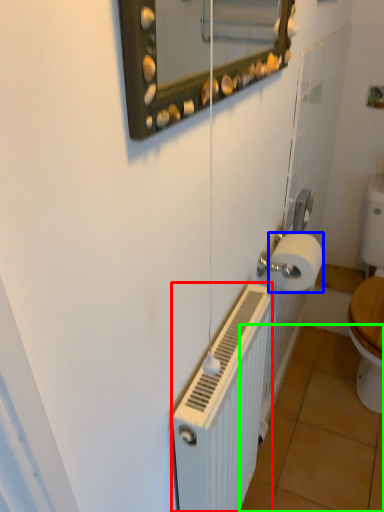
Question: Based on their relative distances, which object is nearer to radiator (highlighted by a red box)? Choose from toilet paper (highlighted by a blue box) and tile (highlighted by a green box).

Choices:
 (A) toilet paper
 (B) tile

Answer: (A)